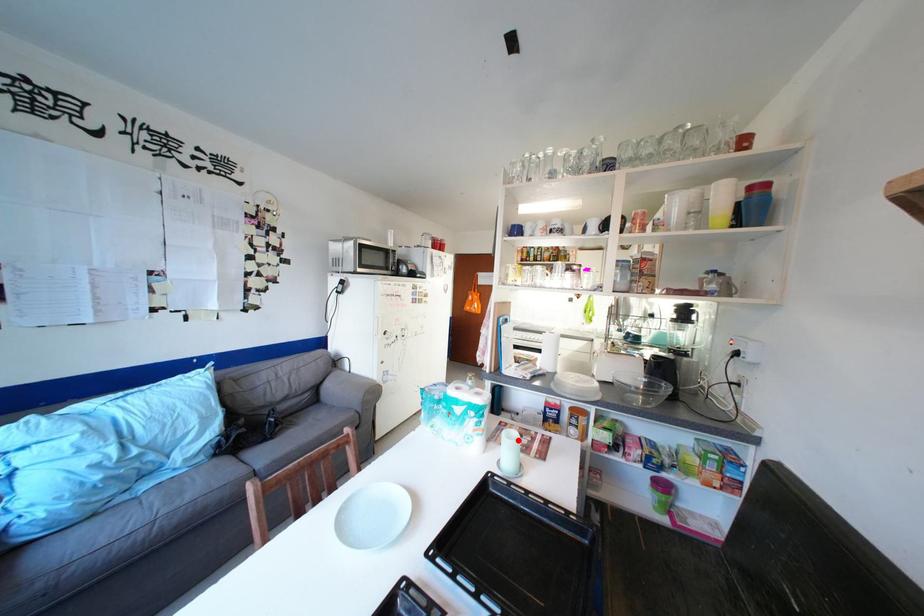
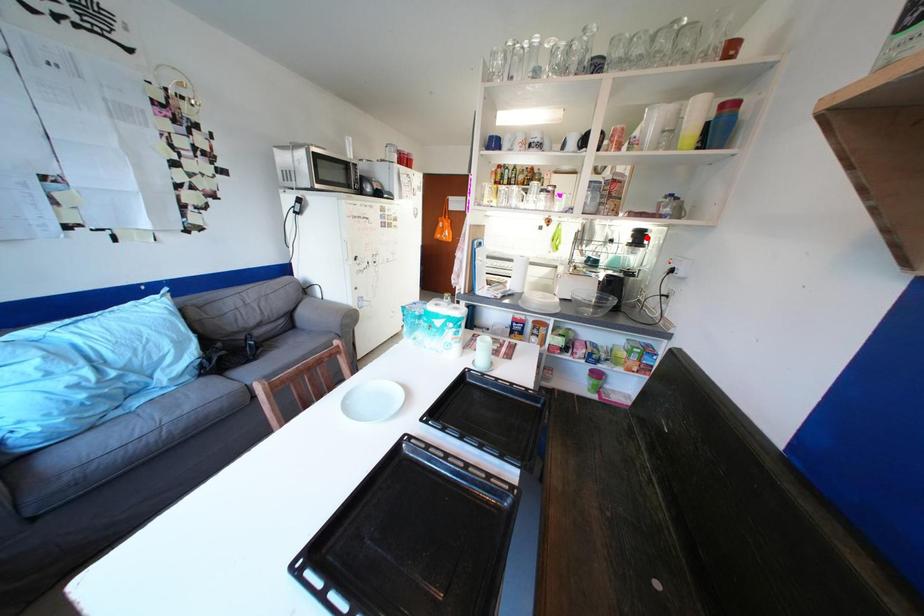
I am providing you with two images of the same scene from different viewpoints. A red point is marked on the first image and another point is marked on the second image. Is the red point in image1 aligned with the point shown in image2?

No